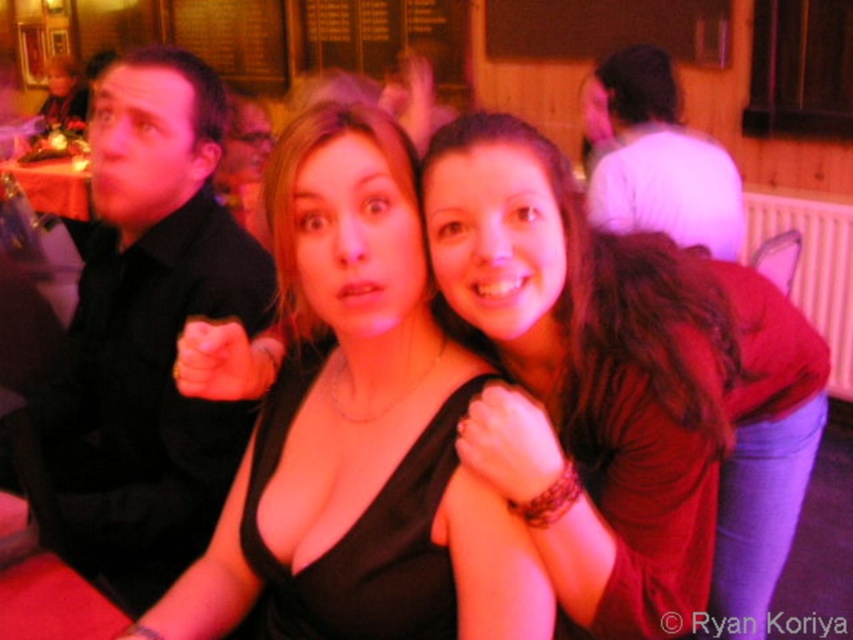
Does black matte dress at center lie behind white matte shirt at upper center?

No, black matte dress at center is in front of white matte shirt at upper center.

In the scene shown: Which is below, black matte dress at center or white matte shirt at upper center?

black matte dress at center is below.

Locate an element on the screen. This screenshot has width=853, height=640. black matte dress at center is located at coordinates (363, 424).

You are a GUI agent. You are given a task and a screenshot of the screen. Output one action in this format:
    pyautogui.click(x=<x>, y=<y>)
    Task: Click on the black matte dress at center
    The height and width of the screenshot is (640, 853).
    Given the screenshot: What is the action you would take?
    (x=363, y=424)

Looking at this image, between matte black dress at center and black matte dress at center, which one appears on the right side from the viewer's perspective?

Positioned to the right is matte black dress at center.

Who is shorter, matte black dress at center or black matte dress at center?

Standing shorter between the two is black matte dress at center.

At what (x,y) coordinates should I click in order to perform the action: click on matte black dress at center. Please return your answer as a coordinate pair (x, y). Looking at the image, I should click on (607, 369).

Locate an element on the screen. This screenshot has width=853, height=640. matte black dress at center is located at coordinates pos(607,369).

Between black shirt at left and white matte shirt at upper center, which one appears on the right side from the viewer's perspective?

From the viewer's perspective, white matte shirt at upper center appears more on the right side.

Who is taller, black shirt at left or white matte shirt at upper center?

With more height is black shirt at left.

Where is `black shirt at left`? Image resolution: width=853 pixels, height=640 pixels. black shirt at left is located at coordinates (149, 330).